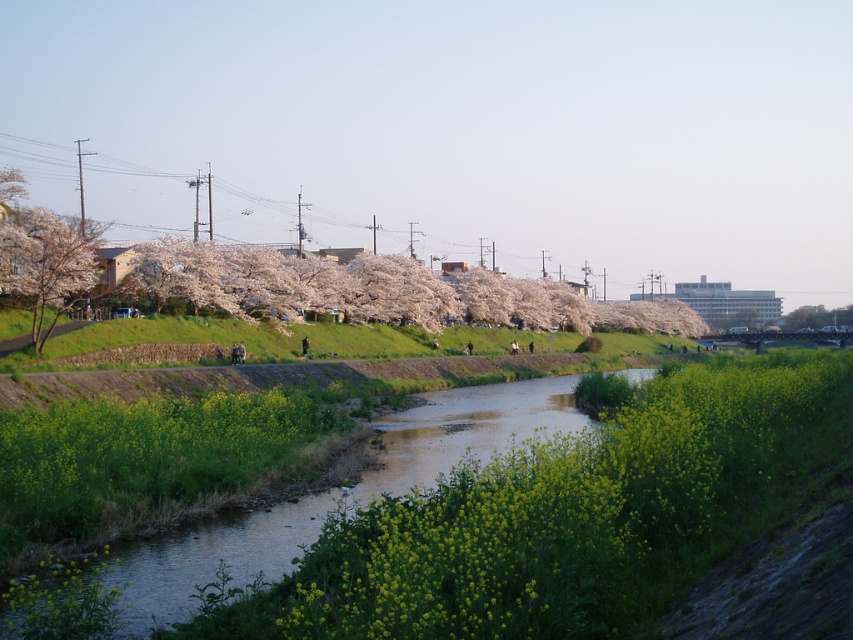
Who is positioned more to the left, green leafy plant at center or cherry blossom tree at left?

cherry blossom tree at left is more to the left.

Can you confirm if green leafy plant at center is smaller than cherry blossom tree at left?

Correct, green leafy plant at center occupies less space than cherry blossom tree at left.

What do you see at coordinates (583, 513) in the screenshot?
I see `green leafy plant at center` at bounding box center [583, 513].

Locate an element on the screen. This screenshot has width=853, height=640. green leafy plant at center is located at coordinates (583, 513).

Describe the element at coordinates (363, 225) in the screenshot. This screenshot has width=853, height=640. I see `metallic wires at upper center` at that location.

Who is positioned more to the right, metallic wires at upper center or cherry blossom tree at left?

Positioned to the right is cherry blossom tree at left.

Which is in front, point (221, 179) or point (30, 262)?

Point (30, 262) is more forward.

I want to click on metallic wires at upper center, so click(x=363, y=225).

From the picture: Between green leafy plant at center and metallic wires at upper center, which one has more height?

metallic wires at upper center

Which of these two, green leafy plant at center or metallic wires at upper center, stands shorter?

green leafy plant at center is shorter.

Image resolution: width=853 pixels, height=640 pixels. Describe the element at coordinates (583, 513) in the screenshot. I see `green leafy plant at center` at that location.

The image size is (853, 640). Identify the location of green leafy plant at center. (583, 513).